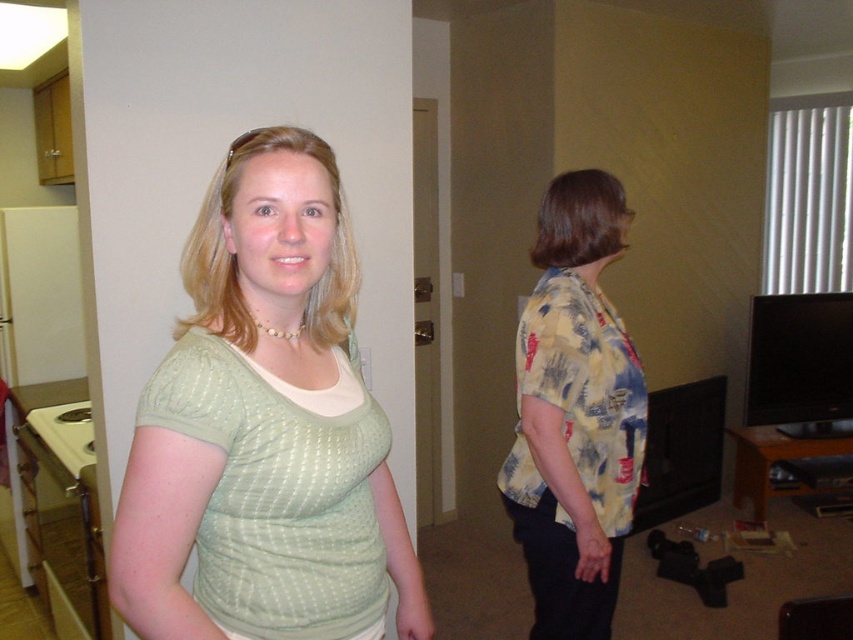
Question: Which of the following is the farthest from the observer?

Choices:
 (A) yellow floral shirt at right
 (B) green textured shirt at center

Answer: (A)

Question: Does green textured shirt at center lie behind yellow floral shirt at right?

Choices:
 (A) yes
 (B) no

Answer: (B)

Question: Does green textured shirt at center appear over yellow floral shirt at right?

Choices:
 (A) yes
 (B) no

Answer: (A)

Question: Which point is closer to the camera?

Choices:
 (A) (338, 580)
 (B) (532, 420)

Answer: (A)

Question: Among these points, which one is nearest to the camera?

Choices:
 (A) (345, 504)
 (B) (518, 353)

Answer: (A)

Question: Can you confirm if green textured shirt at center is bigger than yellow floral shirt at right?

Choices:
 (A) no
 (B) yes

Answer: (B)